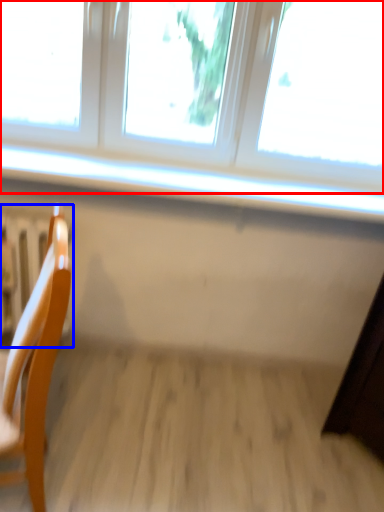
Question: Among these objects, which one is farthest to the camera, window (highlighted by a red box) or radiator (highlighted by a blue box)?

Choices:
 (A) window
 (B) radiator

Answer: (B)